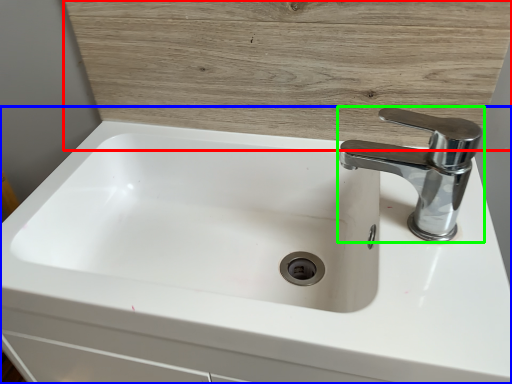
Question: Which object is the closest to the wood (highlighted by a red box)? Choose among these: sink (highlighted by a blue box) or tap (highlighted by a green box).

Choices:
 (A) sink
 (B) tap

Answer: (B)